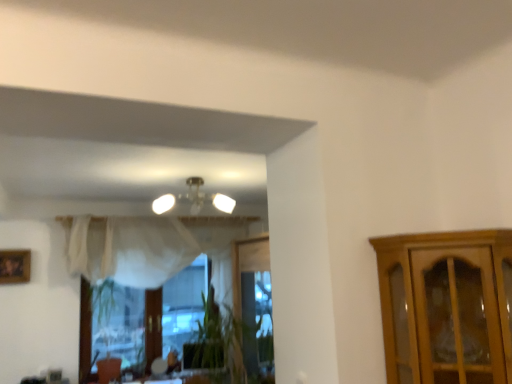
Question: From the image's perspective, does matte white chandelier at upper center appear lower than wooden framed photo at lower left?

Choices:
 (A) no
 (B) yes

Answer: (A)

Question: Is there a large distance between matte white chandelier at upper center and wooden framed photo at lower left?

Choices:
 (A) yes
 (B) no

Answer: (A)

Question: Is wooden framed photo at lower left at the back of matte white chandelier at upper center?

Choices:
 (A) yes
 (B) no

Answer: (B)

Question: Can you confirm if matte white chandelier at upper center is shorter than wooden framed photo at lower left?

Choices:
 (A) no
 (B) yes

Answer: (B)

Question: Does matte white chandelier at upper center have a greater height compared to wooden framed photo at lower left?

Choices:
 (A) yes
 (B) no

Answer: (B)

Question: From the image's perspective, is matte white chandelier at upper center over wooden framed photo at lower left?

Choices:
 (A) no
 (B) yes

Answer: (B)

Question: Is wooden framed photo at lower left taller than matte white chandelier at upper center?

Choices:
 (A) yes
 (B) no

Answer: (A)

Question: Are wooden framed photo at lower left and matte white chandelier at upper center far apart?

Choices:
 (A) yes
 (B) no

Answer: (A)

Question: From the image's perspective, is wooden framed photo at lower left over matte white chandelier at upper center?

Choices:
 (A) yes
 (B) no

Answer: (B)

Question: Is matte white chandelier at upper center inside wooden framed photo at lower left?

Choices:
 (A) no
 (B) yes

Answer: (A)

Question: From a real-world perspective, is wooden framed photo at lower left positioned over matte white chandelier at upper center based on gravity?

Choices:
 (A) no
 (B) yes

Answer: (A)

Question: From the image's perspective, does wooden framed photo at lower left appear lower than matte white chandelier at upper center?

Choices:
 (A) yes
 (B) no

Answer: (A)

Question: Is wooden framed photo at lower left inside the boundaries of matte white chandelier at upper center, or outside?

Choices:
 (A) outside
 (B) inside

Answer: (A)